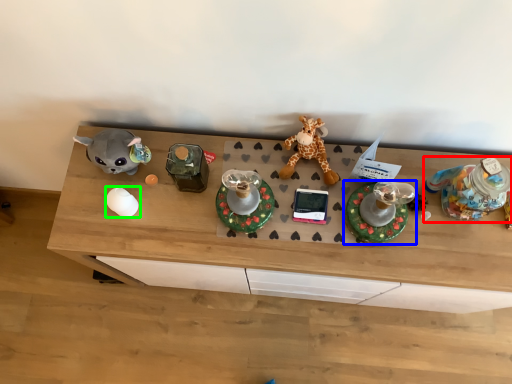
Question: Which object is positioned closest to toy (highlighted by a red box)? Select from toy (highlighted by a blue box) and toy (highlighted by a green box).

Choices:
 (A) toy
 (B) toy

Answer: (A)